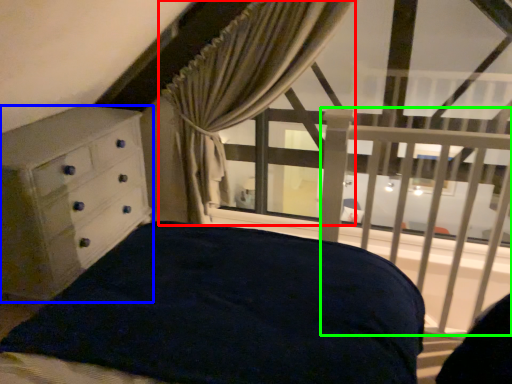
Question: Estimate the real-world distances between objects in this image. Which object is closer to curtain (highlighted by a red box), chest of drawers (highlighted by a blue box) or balustrade (highlighted by a green box)?

Choices:
 (A) chest of drawers
 (B) balustrade

Answer: (A)